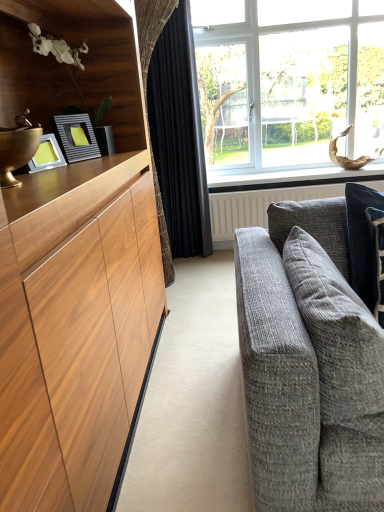
Where is `white painted wood at upper center`? This screenshot has width=384, height=512. white painted wood at upper center is located at coordinates (300, 179).

At what (x,y) coordinates should I click in order to perform the action: click on clear glass window at upper right. Please return your answer as a coordinate pair (x, y). The width and height of the screenshot is (384, 512). Looking at the image, I should click on (288, 82).

This screenshot has height=512, width=384. What do you see at coordinates (337, 335) in the screenshot?
I see `gray textured pillow at right, arranged as the first pillow when viewed from the left` at bounding box center [337, 335].

At what (x,y) coordinates should I click in order to perform the action: click on dark blue textured pillow at right, the 1th pillow in the right-to-left sequence. Please return your answer as a coordinate pair (x, y). The image size is (384, 512). Looking at the image, I should click on (365, 242).

Considering the sizes of objects white textured radiator at center and gray textured pillow at right, which is counted as the second pillow, starting from the right, in the image provided, who is shorter, white textured radiator at center or gray textured pillow at right, which is counted as the second pillow, starting from the right,?

gray textured pillow at right, which is counted as the second pillow, starting from the right, is shorter.

Is the surface of white textured radiator at center in direct contact with gray textured pillow at right, which is counted as the second pillow, starting from the right?

white textured radiator at center is not next to gray textured pillow at right, which is counted as the second pillow, starting from the right, and they're not touching.

Considering the relative positions of white textured radiator at center and gray textured pillow at right, arranged as the first pillow when viewed from the left, in the image provided, is white textured radiator at center to the right of gray textured pillow at right, arranged as the first pillow when viewed from the left, from the viewer's perspective?

Correct, you'll find white textured radiator at center to the right of gray textured pillow at right, arranged as the first pillow when viewed from the left.

Does white textured radiator at center come in front of gray textured pillow at right, which is counted as the second pillow, starting from the right?

No.

What's the angular difference between clear glass window at upper right and black velvet curtain at center's facing directions?

clear glass window at upper right and black velvet curtain at center are facing 0.0587 degrees away from each other.

Where is `window that appears behind the black velvet curtain at center`? window that appears behind the black velvet curtain at center is located at coordinates (288, 82).

Which object is wider, clear glass window at upper right or black velvet curtain at center?

clear glass window at upper right.

Is clear glass window at upper right smaller than black velvet curtain at center?

Incorrect, clear glass window at upper right is not smaller in size than black velvet curtain at center.

Between white painted wood at upper center and black velvet curtain at center, which one has larger size?

With larger size is black velvet curtain at center.

Consider the image. Is white painted wood at upper center positioned with its back to black velvet curtain at center?

white painted wood at upper center does not have its back to black velvet curtain at center.

From a real-world perspective, is white painted wood at upper center positioned under black velvet curtain at center based on gravity?

Yes.

Is point (290, 175) closer to camera compared to point (333, 365)?

That is False.

Who is shorter, white painted wood at upper center or gray textured pillow at right, which is counted as the second pillow, starting from the right?

white painted wood at upper center.

Which is correct: white painted wood at upper center is inside gray textured pillow at right, which is counted as the second pillow, starting from the right, or outside of it?

white painted wood at upper center is not enclosed by gray textured pillow at right, which is counted as the second pillow, starting from the right.

Between white painted wood at upper center and gray textured pillow at right, which is counted as the second pillow, starting from the right, which one appears on the right side from the viewer's perspective?

white painted wood at upper center is more to the right.

From the image's perspective, is white painted wood at upper center below metallic silver picture frame at left?

No.

In order to click on picture frame below the white painted wood at upper center (from the image's perspective) in this screenshot , I will do `click(73, 139)`.

Considering the positions of objects white painted wood at upper center and metallic silver picture frame at left in the image provided, who is more to the left, white painted wood at upper center or metallic silver picture frame at left?

metallic silver picture frame at left.

What's the angular difference between white painted wood at upper center and metallic silver picture frame at left's facing directions?

white painted wood at upper center and metallic silver picture frame at left are facing 71.5 degrees away from each other.

Can you confirm if white textured radiator at center is smaller than dark blue textured pillow at right, acting as the 2th pillow starting from the left?

Actually, white textured radiator at center might be larger than dark blue textured pillow at right, acting as the 2th pillow starting from the left.

Is white textured radiator at center not close to dark blue textured pillow at right, the 1th pillow in the right-to-left sequence?

That's right, there is a large distance between white textured radiator at center and dark blue textured pillow at right, the 1th pillow in the right-to-left sequence.

Considering the relative positions of white textured radiator at center and dark blue textured pillow at right, acting as the 2th pillow starting from the left, in the image provided, is white textured radiator at center in front of dark blue textured pillow at right, acting as the 2th pillow starting from the left,?

No, the depth of white textured radiator at center is greater than that of dark blue textured pillow at right, acting as the 2th pillow starting from the left.

Is white textured radiator at center facing away from dark blue textured pillow at right, acting as the 2th pillow starting from the left?

white textured radiator at center does not have its back to dark blue textured pillow at right, acting as the 2th pillow starting from the left.

Relative to white painted wood at upper center, is white textured radiator at center in front or behind?

In the image, white textured radiator at center appears in front of white painted wood at upper center.

From the image's perspective, is white textured radiator at center positioned above or below white painted wood at upper center?

white textured radiator at center is situated lower than white painted wood at upper center in the image.

Can white painted wood at upper center be found inside white textured radiator at center?

No, white painted wood at upper center is not surrounded by white textured radiator at center.

Where is `radiator on the right of gray textured pillow at right, arranged as the first pillow when viewed from the left`? radiator on the right of gray textured pillow at right, arranged as the first pillow when viewed from the left is located at coordinates (257, 206).

Where is `curtain that is below the clear glass window at upper right (from the image's perspective)`? The image size is (384, 512). curtain that is below the clear glass window at upper right (from the image's perspective) is located at coordinates (179, 137).

Looking at the image, which one is located further to dark blue textured pillow at right, acting as the 2th pillow starting from the left, clear glass window at upper right or white painted wood at upper center?

clear glass window at upper right lies further to dark blue textured pillow at right, acting as the 2th pillow starting from the left, than the other object.

Which object lies nearer to the anchor point clear glass window at upper right, gray textured pillow at right, which is counted as the second pillow, starting from the right, or black velvet curtain at center?

black velvet curtain at center is closer to clear glass window at upper right.

Which object lies further to the anchor point white painted wood at upper center, gray textured pillow at right, arranged as the first pillow when viewed from the left, or clear glass window at upper right?

gray textured pillow at right, arranged as the first pillow when viewed from the left.

Estimate the real-world distances between objects in this image. Which object is closer to white textured radiator at center, white painted wood at upper center or metallic silver picture frame at left?

Among the two, white painted wood at upper center is located nearer to white textured radiator at center.

When comparing their distances from white painted wood at upper center, does black velvet curtain at center or dark blue textured pillow at right, acting as the 2th pillow starting from the left, seem further?

dark blue textured pillow at right, acting as the 2th pillow starting from the left, is positioned further to the anchor white painted wood at upper center.

From the image, which object appears to be farther from white textured radiator at center, clear glass window at upper right or gray textured pillow at right, which is counted as the second pillow, starting from the right?

Based on the image, gray textured pillow at right, which is counted as the second pillow, starting from the right, appears to be further to white textured radiator at center.

Considering their positions, is white textured radiator at center positioned further to clear glass window at upper right than dark blue textured pillow at right, acting as the 2th pillow starting from the left?

dark blue textured pillow at right, acting as the 2th pillow starting from the left, is positioned further to the anchor clear glass window at upper right.

Looking at the image, which one is located further to gray textured pillow at right, arranged as the first pillow when viewed from the left, white painted wood at upper center or dark blue textured pillow at right, acting as the 2th pillow starting from the left?

white painted wood at upper center lies further to gray textured pillow at right, arranged as the first pillow when viewed from the left, than the other object.

Where is `pillow between gray textured pillow at right, arranged as the first pillow when viewed from the left, and black velvet curtain at center, along the z-axis`? Image resolution: width=384 pixels, height=512 pixels. pillow between gray textured pillow at right, arranged as the first pillow when viewed from the left, and black velvet curtain at center, along the z-axis is located at coordinates (365, 242).

Locate an element on the screen. window between dark blue textured pillow at right, acting as the 2th pillow starting from the left, and white painted wood at upper center from front to back is located at coordinates (288, 82).

Locate an element on the screen. curtain between gray textured pillow at right, which is counted as the second pillow, starting from the right, and white painted wood at upper center, along the z-axis is located at coordinates (179, 137).

I want to click on curtain between gray textured pillow at right, which is counted as the second pillow, starting from the right, and white textured radiator at center in the front-back direction, so click(179, 137).